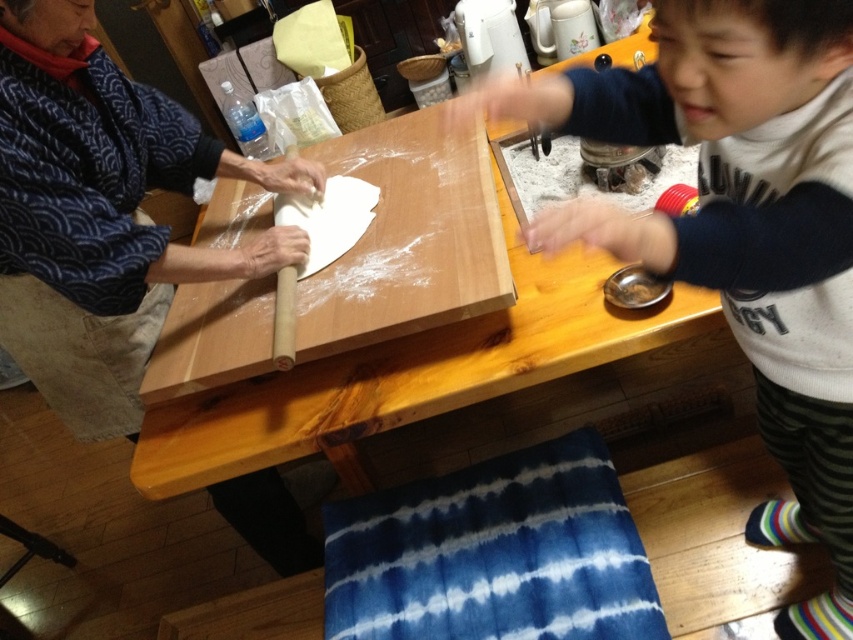
Is white cotton sweater at right below white dough at center?

Correct, white cotton sweater at right is located below white dough at center.

Is point (778, 520) closer to camera compared to point (340, 179)?

Yes, point (778, 520) is closer to viewer.

Locate an element on the screen. white cotton sweater at right is located at coordinates (741, 227).

Does matte black rolling pin at left have a greater height compared to white dough at center?

Correct, matte black rolling pin at left is much taller as white dough at center.

Does matte black rolling pin at left have a larger size compared to white dough at center?

Yes, matte black rolling pin at left is bigger than white dough at center.

Between point (115, 163) and point (273, 205), which one is positioned behind?

Point (273, 205)

The width and height of the screenshot is (853, 640). What are the coordinates of `matte black rolling pin at left` in the screenshot? It's located at (102, 214).

Locate an element on the screen. white cotton sweater at right is located at coordinates (741, 227).

Is point (769, 220) less distant than point (103, 163)?

Yes.

Locate an element on the screen. Image resolution: width=853 pixels, height=640 pixels. white cotton sweater at right is located at coordinates (741, 227).